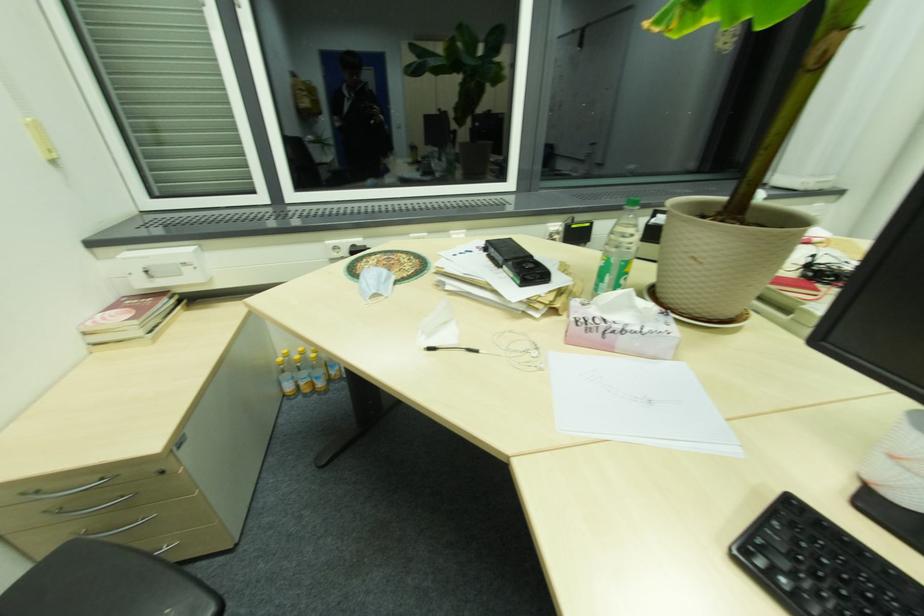
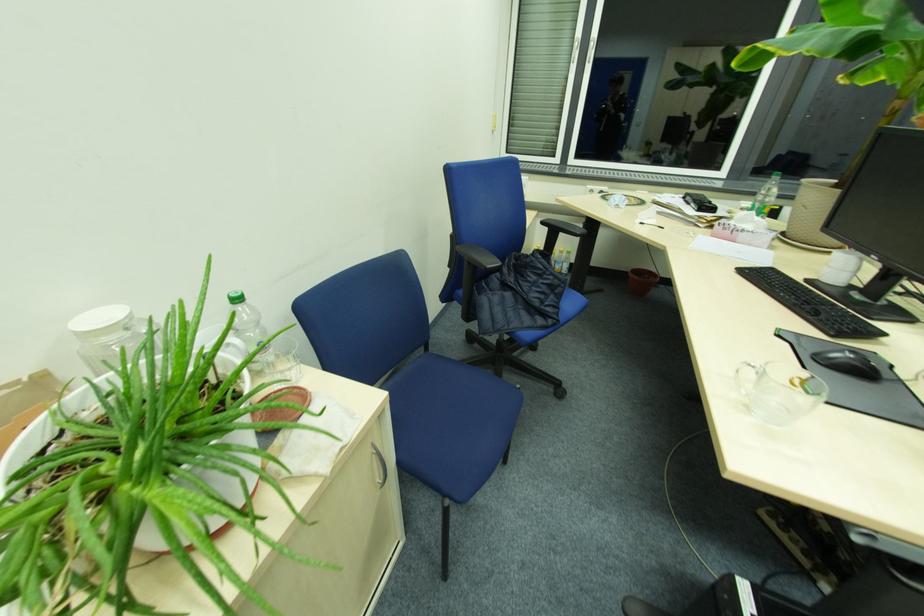
Where in the second image is the point corresponding to (x=697, y=262) from the first image?

(808, 209)